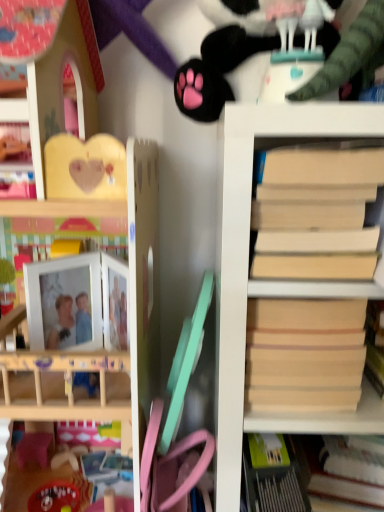
Image resolution: width=384 pixels, height=512 pixels. I want to click on beige cardboard book at right, so 316,214.

The width and height of the screenshot is (384, 512). What do you see at coordinates (285, 58) in the screenshot? I see `black plush paw at upper center` at bounding box center [285, 58].

Find the location of a particular element. light beige wood bookshelf at right, which is the first shelf from right to left is located at coordinates (266, 281).

How far apart are wooden dollhouse at upper left, acting as the 1th shelf starting from the left, and beige cardboard book at right?

wooden dollhouse at upper left, acting as the 1th shelf starting from the left, is 29.53 centimeters away from beige cardboard book at right.

Based on the photo, are wooden dollhouse at upper left, acting as the 1th shelf starting from the left, and beige cardboard book at right far apart?

No.

Based on the photo, considering the positions of objects wooden dollhouse at upper left, the 2th shelf from the right, and beige cardboard book at right in the image provided, who is more to the right, wooden dollhouse at upper left, the 2th shelf from the right, or beige cardboard book at right?

Positioned to the right is beige cardboard book at right.

Is wooden dollhouse at upper left, the 2th shelf from the right, taller or shorter than beige cardboard book at right?

wooden dollhouse at upper left, the 2th shelf from the right, is taller than beige cardboard book at right.

From a real-world perspective, between light beige wood bookshelf at right, which is the first shelf from right to left, and wooden dollhouse at upper left, acting as the 1th shelf starting from the left, who is vertically higher?

wooden dollhouse at upper left, acting as the 1th shelf starting from the left, is physically above.

Considering the relative sizes of light beige wood bookshelf at right, acting as the second shelf starting from the left, and wooden dollhouse at upper left, the 2th shelf from the right, in the image provided, is light beige wood bookshelf at right, acting as the second shelf starting from the left, wider than wooden dollhouse at upper left, the 2th shelf from the right,?

Correct, the width of light beige wood bookshelf at right, acting as the second shelf starting from the left, exceeds that of wooden dollhouse at upper left, the 2th shelf from the right.

Who is smaller, light beige wood bookshelf at right, which is the first shelf from right to left, or wooden dollhouse at upper left, the 2th shelf from the right?

wooden dollhouse at upper left, the 2th shelf from the right.

From the image's perspective, between light beige wood bookshelf at right, acting as the second shelf starting from the left, and wooden dollhouse at upper left, the 2th shelf from the right, which one is located above?

wooden dollhouse at upper left, the 2th shelf from the right, is shown above in the image.

Based on the photo, which is farther from the camera, (x=128, y=205) or (x=325, y=85)?

The point (x=128, y=205) is farther from the camera.

Is black plush paw at upper center at the back of wooden dollhouse at upper left, the 2th shelf from the right?

wooden dollhouse at upper left, the 2th shelf from the right, does not have its back to black plush paw at upper center.

Would you consider wooden dollhouse at upper left, the 2th shelf from the right, to be distant from black plush paw at upper center?

No, wooden dollhouse at upper left, the 2th shelf from the right, is not far away from black plush paw at upper center.

Visually, is beige matte paper at right positioned to the left or to the right of wooden dollhouse at upper left, the 2th shelf from the right?

From the image, it's evident that beige matte paper at right is to the right of wooden dollhouse at upper left, the 2th shelf from the right.

From the image's perspective, who appears lower, beige matte paper at right or wooden dollhouse at upper left, acting as the 1th shelf starting from the left?

beige matte paper at right appears lower in the image.

Is beige matte paper at right smaller than wooden dollhouse at upper left, acting as the 1th shelf starting from the left?

Indeed, beige matte paper at right has a smaller size compared to wooden dollhouse at upper left, acting as the 1th shelf starting from the left.

How different are the orientations of light beige wood bookshelf at right, which is the first shelf from right to left, and black plush paw at upper center in degrees?

The angle between the facing direction of light beige wood bookshelf at right, which is the first shelf from right to left, and the facing direction of black plush paw at upper center is 0.739 degrees.

Is light beige wood bookshelf at right, acting as the second shelf starting from the left, wider than black plush paw at upper center?

Correct, the width of light beige wood bookshelf at right, acting as the second shelf starting from the left, exceeds that of black plush paw at upper center.

From the image's perspective, is light beige wood bookshelf at right, acting as the second shelf starting from the left, positioned above or below black plush paw at upper center?

Clearly, from the image's perspective, light beige wood bookshelf at right, acting as the second shelf starting from the left, is below black plush paw at upper center.

At what (x,y) coordinates should I click in order to perform the action: click on toy on the left of light beige wood bookshelf at right, which is the first shelf from right to left. Please return your answer as a coordinate pair (x, y). Image resolution: width=384 pixels, height=512 pixels. Looking at the image, I should click on (285, 58).

Which is closer, (288, 9) or (313, 126)?

The point (313, 126) is closer.

From the image's perspective, is black plush paw at upper center under light beige wood bookshelf at right, acting as the second shelf starting from the left?

No.

Is black plush paw at upper center smaller than light beige wood bookshelf at right, which is the first shelf from right to left?

Indeed, black plush paw at upper center has a smaller size compared to light beige wood bookshelf at right, which is the first shelf from right to left.

From a real-world perspective, between beige cardboard book at right and black plush paw at upper center, who is vertically higher?

black plush paw at upper center.

In the image, there is a black plush paw at upper center. In order to click on book below it (from a real-world perspective) in this screenshot , I will do `click(316, 214)`.

Looking at their sizes, would you say beige cardboard book at right is wider or thinner than black plush paw at upper center?

In the image, beige cardboard book at right appears to be more narrow than black plush paw at upper center.

The image size is (384, 512). I want to click on book that appears in front of the wooden dollhouse at upper left, the 2th shelf from the right, so click(x=316, y=214).

You are a GUI agent. You are given a task and a screenshot of the screen. Output one action in this format:
    pyautogui.click(x=<x>, y=<y>)
    Task: Click on the shelf on the left of light beige wood bookshelf at right, which is the first shelf from right to left
    The height and width of the screenshot is (512, 384).
    Given the screenshot: What is the action you would take?
    pyautogui.click(x=143, y=283)

From the picture: From the image, which object appears to be farther from wooden dollhouse at upper left, acting as the 1th shelf starting from the left, black plush paw at upper center or light beige wood bookshelf at right, which is the first shelf from right to left?

black plush paw at upper center is further to wooden dollhouse at upper left, acting as the 1th shelf starting from the left.

From the image, which object appears to be nearer to beige cardboard book at right, beige matte paper at right or wooden dollhouse at upper left, the 2th shelf from the right?

beige matte paper at right.

Looking at the image, which one is located closer to beige cardboard book at right, beige matte paper at right or black plush paw at upper center?

beige matte paper at right.

Which object lies further to the anchor point wooden dollhouse at upper left, the 2th shelf from the right, light beige wood bookshelf at right, which is the first shelf from right to left, or beige cardboard book at right?

beige cardboard book at right lies further to wooden dollhouse at upper left, the 2th shelf from the right, than the other object.

Based on their spatial positions, is black plush paw at upper center or light beige wood bookshelf at right, acting as the second shelf starting from the left, further from beige matte paper at right?

Among the two, black plush paw at upper center is located further to beige matte paper at right.

Looking at this image, which object lies nearer to the anchor point beige matte paper at right, light beige wood bookshelf at right, which is the first shelf from right to left, or beige cardboard book at right?

Based on the image, light beige wood bookshelf at right, which is the first shelf from right to left, appears to be nearer to beige matte paper at right.

When comparing their distances from beige matte paper at right, does wooden dollhouse at upper left, acting as the 1th shelf starting from the left, or light beige wood bookshelf at right, acting as the second shelf starting from the left, seem further?

wooden dollhouse at upper left, acting as the 1th shelf starting from the left, is positioned further to the anchor beige matte paper at right.

Considering their positions, is beige cardboard book at right positioned further to beige matte paper at right than wooden dollhouse at upper left, the 2th shelf from the right?

The object further to beige matte paper at right is wooden dollhouse at upper left, the 2th shelf from the right.

Find the location of a particular element. The width and height of the screenshot is (384, 512). paperback book situated between wooden dollhouse at upper left, the 2th shelf from the right, and beige cardboard book at right from left to right is located at coordinates (304, 354).

Identify the location of book between black plush paw at upper center and beige matte paper at right in the vertical direction. This screenshot has height=512, width=384. (316, 214).

Identify the location of book between wooden dollhouse at upper left, the 2th shelf from the right, and light beige wood bookshelf at right, which is the first shelf from right to left. (316, 214).

Where is `paperback book between black plush paw at upper center and light beige wood bookshelf at right, acting as the second shelf starting from the left, vertically`? The width and height of the screenshot is (384, 512). paperback book between black plush paw at upper center and light beige wood bookshelf at right, acting as the second shelf starting from the left, vertically is located at coordinates (304, 354).